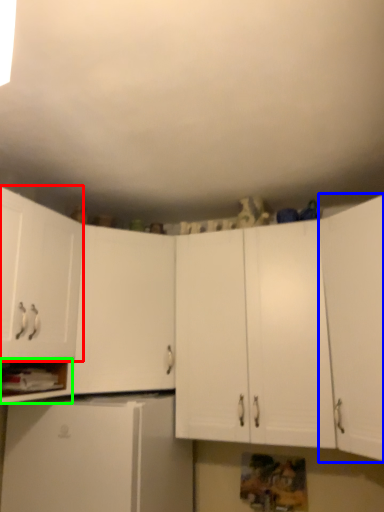
Question: Which object is the farthest from cabinetry (highlighted by a red box)? Choose among these: cabinetry (highlighted by a blue box) or cabinet (highlighted by a green box).

Choices:
 (A) cabinetry
 (B) cabinet

Answer: (A)